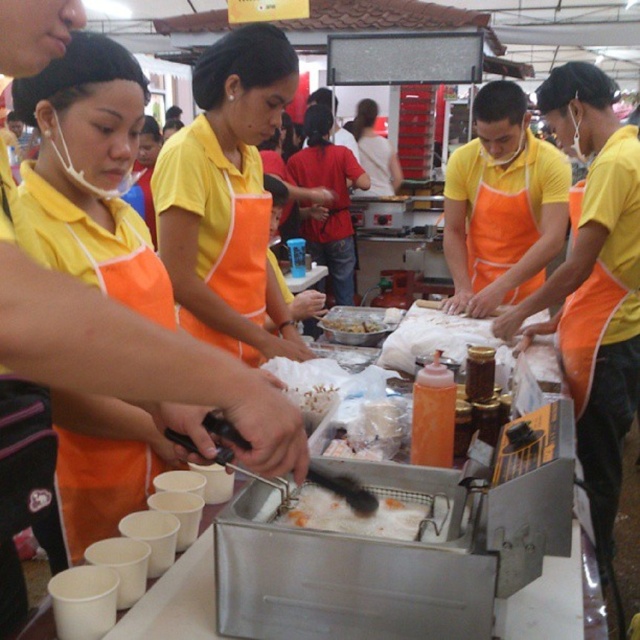
You are a customer at the food stall and want to know which item is closer to the deep fryer. Which one is lower between the fried batter at center and the yellow matte fried chicken at center?

The fried batter at center is below the yellow matte fried chicken at center, so the fried batter at center is lower and closer to the deep fryer.